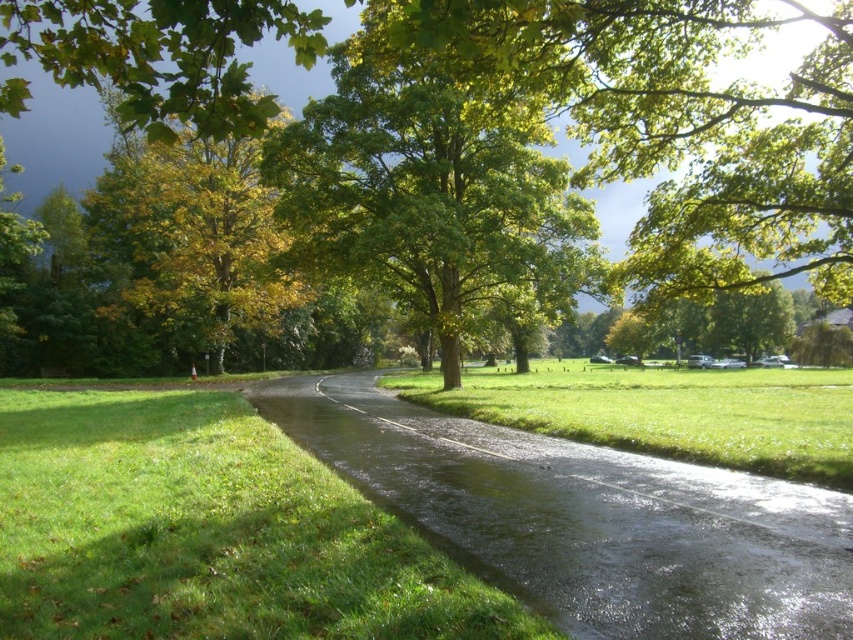
You are a gardener planning to mow the lawn in the park. You have a lawnmower that can cover an area of 10 square meters. You need to decide which area to mow first between the green grass at lower left and the green grassy at center. Which area should you choose if you want to finish mowing with as few passes as possible?

The green grass at lower left has a smaller width than the green grassy at center, so it will require fewer passes to mow. Therefore, you should choose the green grass at lower left first to minimize the number of passes needed.

You are standing at point [32,593] and want to walk to the parked cars under the trees. The path is 4.69 meters long. If your walking speed is 1.5 meters per second, how long will it take you to reach the parked cars?

The distance between you and the parked cars is 4.69 meters. At a walking speed of 1.5 meters per second, it will take approximately 3.13 seconds to reach them.